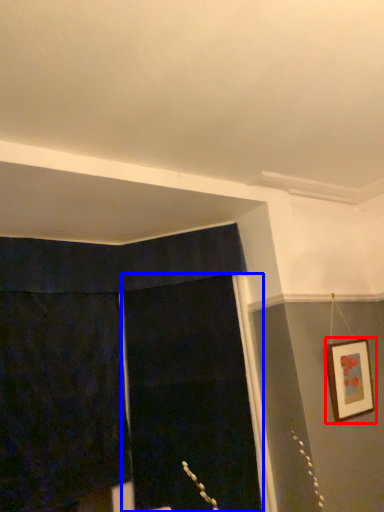
Question: Which of the following is the farthest to the observer, picture frame (highlighted by a red box) or screen door (highlighted by a blue box)?

Choices:
 (A) picture frame
 (B) screen door

Answer: (B)